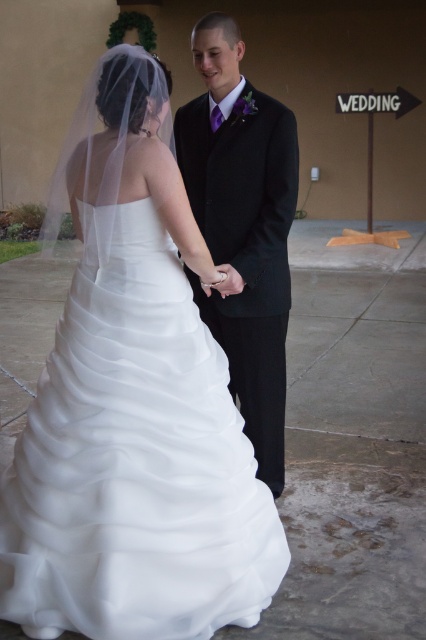
Question: Which point appears closest to the camera in this image?

Choices:
 (A) (255, 416)
 (B) (58, 572)

Answer: (B)

Question: Does white satin dress at center appear on the right side of black satin suit at center?

Choices:
 (A) yes
 (B) no

Answer: (B)

Question: Does white satin dress at center have a greater width compared to black satin suit at center?

Choices:
 (A) no
 (B) yes

Answer: (B)

Question: Can you confirm if white satin dress at center is thinner than black satin suit at center?

Choices:
 (A) yes
 (B) no

Answer: (B)

Question: Which point appears farthest from the camera in this image?

Choices:
 (A) (66, 392)
 (B) (258, 301)

Answer: (B)